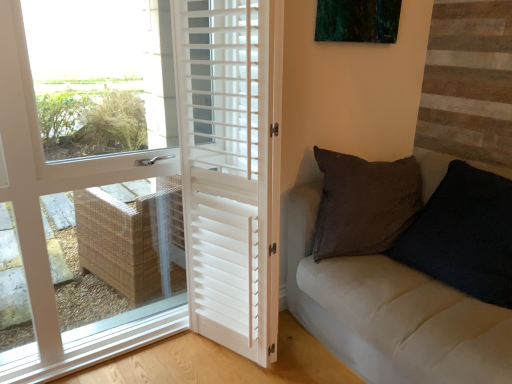
Question: From a real-world perspective, is velvet black pillow at right positioned above or below white matte door at left, which is counted as the first door, starting from the left?

Choices:
 (A) above
 (B) below

Answer: (B)

Question: Is velvet black pillow at right in front of or behind white matte door at left, which is counted as the first door, starting from the left, in the image?

Choices:
 (A) front
 (B) behind

Answer: (B)

Question: Which object is the closest to the white matte shutters at center, which is the first door in right-to-left order?

Choices:
 (A) velvet black pillow at right
 (B) white matte door at left, which is counted as the first door, starting from the left

Answer: (B)

Question: Which of these objects is positioned farthest from the velvet black pillow at right?

Choices:
 (A) white matte shutters at center, which appears as the second door when viewed from the left
 (B) white matte door at left, the second door in the right-to-left sequence

Answer: (B)